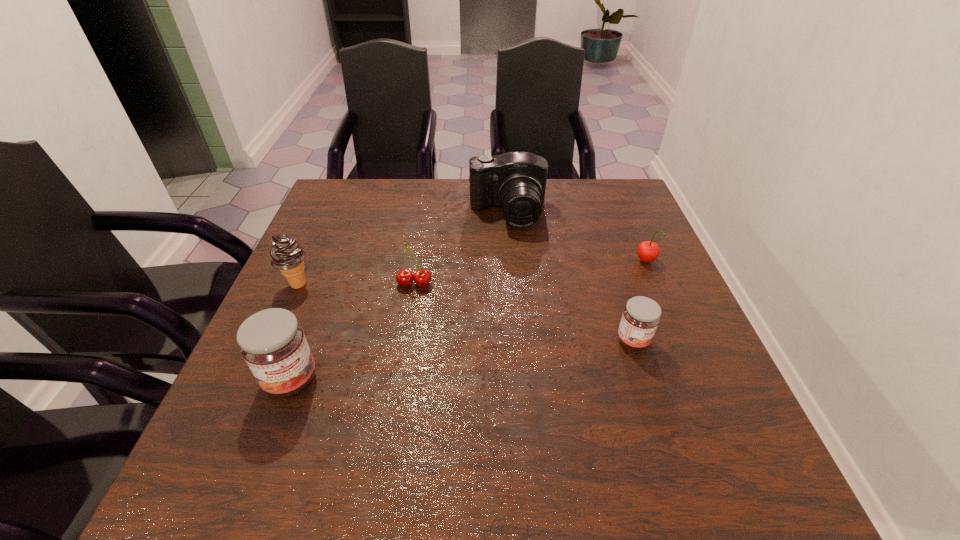
This screenshot has height=540, width=960. What are the coordinates of `the taller jam` in the screenshot? It's located at (272, 342).

Identify the location of the nearest object. (272, 342).

At what (x,y) coordinates should I click in order to perform the action: click on the farther jam. Please return your answer as a coordinate pair (x, y). This screenshot has width=960, height=540. Looking at the image, I should click on (641, 316).

Locate an element on the screen. The image size is (960, 540). the shorter jam is located at coordinates (641, 316).

Identify the location of the farthest object. (515, 181).

The width and height of the screenshot is (960, 540). Find the location of `the third object from right to left`. the third object from right to left is located at coordinates (515, 181).

This screenshot has height=540, width=960. Identify the location of the nearer cherry. (422, 278).

What are the coordinates of `the left cherry` in the screenshot? It's located at (422, 278).

The height and width of the screenshot is (540, 960). Identify the location of icecream. (286, 254).

Locate an element on the screen. Image resolution: width=960 pixels, height=540 pixels. the fifth nearest object is located at coordinates (648, 251).